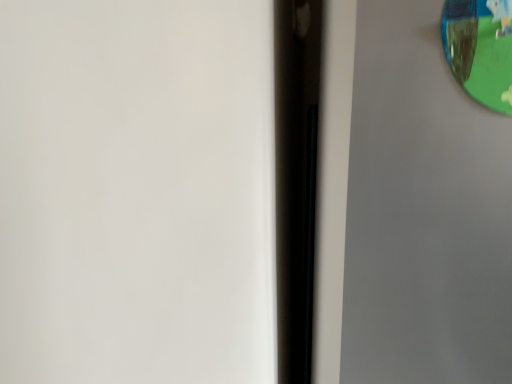
This screenshot has width=512, height=384. I want to click on transparent plastic screen door at upper right, so click(x=408, y=208).

What do you see at coordinates (408, 208) in the screenshot? The image size is (512, 384). I see `transparent plastic screen door at upper right` at bounding box center [408, 208].

Image resolution: width=512 pixels, height=384 pixels. Identify the location of green plastic view mirror at upper right. (480, 49).

Describe the element at coordinates (480, 49) in the screenshot. Image resolution: width=512 pixels, height=384 pixels. I see `green plastic view mirror at upper right` at that location.

Identify the location of transparent plastic screen door at upper right. Image resolution: width=512 pixels, height=384 pixels. pos(408,208).

Considering the positions of objects transparent plastic screen door at upper right and green plastic view mirror at upper right in the image provided, who is more to the left, transparent plastic screen door at upper right or green plastic view mirror at upper right?

Positioned to the left is green plastic view mirror at upper right.

In the scene shown: Between transparent plastic screen door at upper right and green plastic view mirror at upper right, which one is positioned in front?

transparent plastic screen door at upper right is in front.

Does point (506, 207) come in front of point (450, 19)?

No.

Consider the image. From the image's perspective, who appears lower, transparent plastic screen door at upper right or green plastic view mirror at upper right?

transparent plastic screen door at upper right appears lower in the image.

From a real-world perspective, relative to green plastic view mirror at upper right, is transparent plastic screen door at upper right vertically above or below?

Clearly, from a real-world perspective, transparent plastic screen door at upper right is below green plastic view mirror at upper right.

In terms of width, does transparent plastic screen door at upper right look wider or thinner when compared to green plastic view mirror at upper right?

Clearly, transparent plastic screen door at upper right has more width compared to green plastic view mirror at upper right.

From the picture: Which of these two, transparent plastic screen door at upper right or green plastic view mirror at upper right, stands taller?

transparent plastic screen door at upper right is taller.

Which of these two, transparent plastic screen door at upper right or green plastic view mirror at upper right, is bigger?

transparent plastic screen door at upper right.

Is green plastic view mirror at upper right inside transparent plastic screen door at upper right?

Yes, green plastic view mirror at upper right can be found within transparent plastic screen door at upper right.

Does transparent plastic screen door at upper right touch green plastic view mirror at upper right?

They are not placed beside each other.

Is transparent plastic screen door at upper right oriented towards green plastic view mirror at upper right?

Yes, transparent plastic screen door at upper right faces towards green plastic view mirror at upper right.

This screenshot has height=384, width=512. Identify the location of view mirror above the transparent plastic screen door at upper right (from a real-world perspective). (480, 49).

From the picture: Is green plastic view mirror at upper right to the left of transparent plastic screen door at upper right from the viewer's perspective?

Indeed, green plastic view mirror at upper right is positioned on the left side of transparent plastic screen door at upper right.

Between green plastic view mirror at upper right and transparent plastic screen door at upper right, which one is positioned behind?

green plastic view mirror at upper right is further from the camera.

Is point (509, 26) in front of point (389, 45)?

Yes, point (509, 26) is in front of point (389, 45).

From the image's perspective, would you say green plastic view mirror at upper right is positioned over transparent plastic screen door at upper right?

Correct, green plastic view mirror at upper right appears higher than transparent plastic screen door at upper right in the image.

Based on the photo, from a real-world perspective, is green plastic view mirror at upper right above or below transparent plastic screen door at upper right?

green plastic view mirror at upper right is situated higher than transparent plastic screen door at upper right in the real world.

Between green plastic view mirror at upper right and transparent plastic screen door at upper right, which one has larger width?

transparent plastic screen door at upper right is wider.

Considering the relative sizes of green plastic view mirror at upper right and transparent plastic screen door at upper right in the image provided, is green plastic view mirror at upper right shorter than transparent plastic screen door at upper right?

Yes.

Considering the relative sizes of green plastic view mirror at upper right and transparent plastic screen door at upper right in the image provided, is green plastic view mirror at upper right smaller than transparent plastic screen door at upper right?

Indeed, green plastic view mirror at upper right has a smaller size compared to transparent plastic screen door at upper right.

Is green plastic view mirror at upper right spatially inside transparent plastic screen door at upper right, or outside of it?

green plastic view mirror at upper right can be found inside transparent plastic screen door at upper right.

Are green plastic view mirror at upper right and transparent plastic screen door at upper right beside each other?

No, green plastic view mirror at upper right is not next to transparent plastic screen door at upper right.

Is green plastic view mirror at upper right turned away from transparent plastic screen door at upper right?

That's right, green plastic view mirror at upper right is facing away from transparent plastic screen door at upper right.

How different are the orientations of green plastic view mirror at upper right and transparent plastic screen door at upper right in degrees?

green plastic view mirror at upper right and transparent plastic screen door at upper right are facing 0.00279 degrees away from each other.

How much distance is there between green plastic view mirror at upper right and transparent plastic screen door at upper right?

green plastic view mirror at upper right and transparent plastic screen door at upper right are 20.90 centimeters apart.

This screenshot has height=384, width=512. Find the location of `screen door that is in front of the green plastic view mirror at upper right`. screen door that is in front of the green plastic view mirror at upper right is located at coordinates (408, 208).

Image resolution: width=512 pixels, height=384 pixels. What are the coordinates of `screen door that appears in front of the green plastic view mirror at upper right` in the screenshot? It's located at (408, 208).

Identify the location of view mirror above the transparent plastic screen door at upper right (from a real-world perspective). (480, 49).